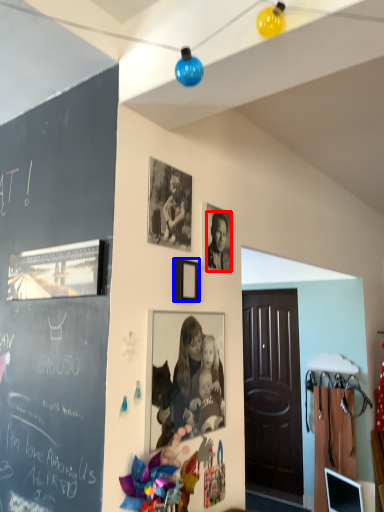
Question: Which object is further to the camera taking this photo, person (highlighted by a red box) or picture frame (highlighted by a blue box)?

Choices:
 (A) person
 (B) picture frame

Answer: (A)